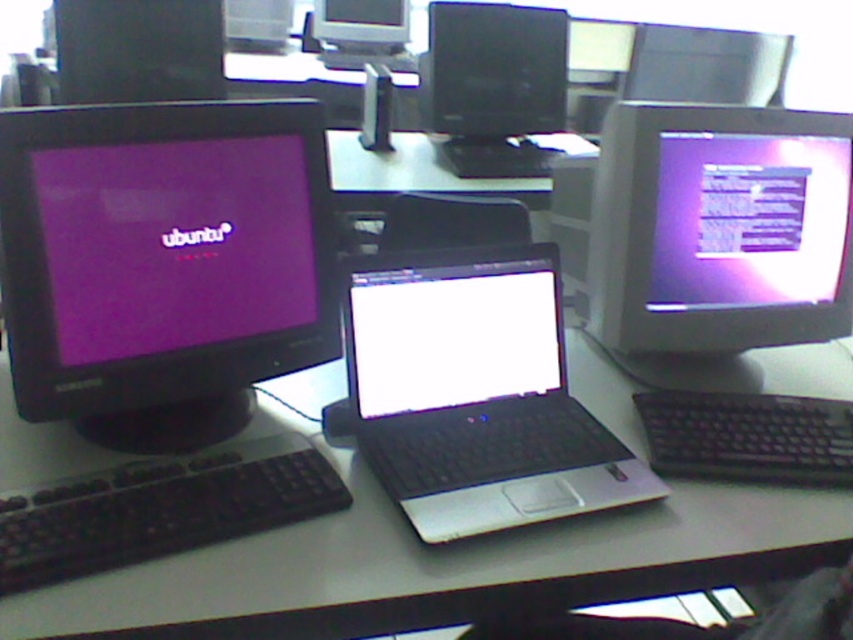
Based on the photo, you are a technician standing 5 feet away from the table in the computer lab. You need to reach the matte purple monitor at right to adjust its settings. Is the distance sufficient for you to comfortably reach it without moving closer?

The matte purple monitor at right is 4.08 feet away from the camera, so if you are standing 5 feet away from the table, you are 1.92 feet further away. This distance may be too far to comfortably reach the monitor without moving closer.

You are a student in the computer lab and need to locate the two matte black monitors. Based on the scene description, which monitor is positioned higher up, the matte black monitor at upper left or the matte black monitor at upper center?

The matte black monitor at upper center is positioned higher up because the matte black monitor at upper left is located below it.